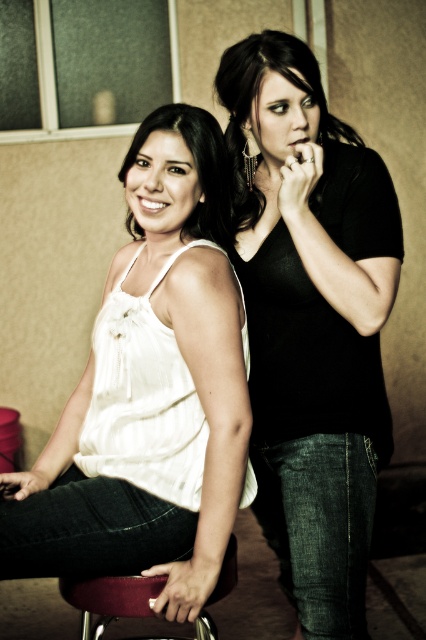
Question: Among these points, which one is farthest from the camera?

Choices:
 (A) (77, 593)
 (B) (164, 218)
 (C) (256, 189)
 (D) (222, 248)

Answer: (C)

Question: Is black matte shirt at center positioned at the back of matte white tank top at center?

Choices:
 (A) yes
 (B) no

Answer: (B)

Question: Which object is farther from the camera taking this photo?

Choices:
 (A) white ribbed tank top at left
 (B) matte white tank top at center

Answer: (B)

Question: Observing the image, what is the correct spatial positioning of white ribbed tank top at left in reference to velvet maroon bar stool at lower center?

Choices:
 (A) left
 (B) right

Answer: (B)

Question: Is black matte shirt at center wider than white ribbed tank top at left?

Choices:
 (A) yes
 (B) no

Answer: (B)

Question: Among these objects, which one is nearest to the camera?

Choices:
 (A) white ribbed tank top at left
 (B) velvet maroon bar stool at lower center
 (C) matte black shirt at upper right
 (D) black matte shirt at center

Answer: (A)